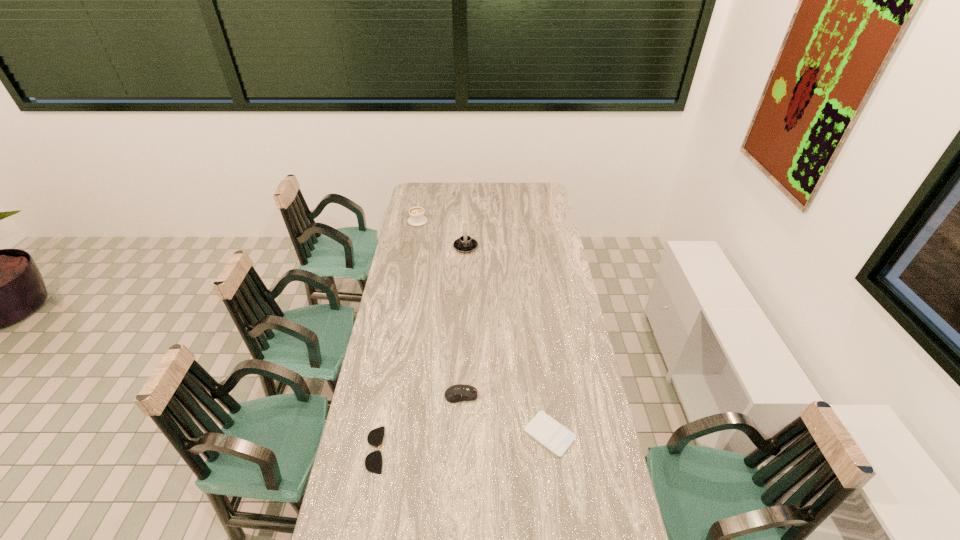
This screenshot has height=540, width=960. I want to click on vacant space located with a handle on the side of the tallest object, so click(x=467, y=214).

The image size is (960, 540). In order to click on vacant space located 0.120m to the right of the farthest object's handle in this screenshot , I will do `click(420, 204)`.

Locate an element on the screen. This screenshot has width=960, height=540. blank area located to the right of the farthest object's handle is located at coordinates (423, 188).

You are a GUI agent. You are given a task and a screenshot of the screen. Output one action in this format:
    pyautogui.click(x=<x>, y=<y>)
    Task: Click on the vacant point located 0.360m to the right of the farthest object's handle
    This screenshot has height=540, width=960.
    Given the screenshot: What is the action you would take?
    pyautogui.click(x=424, y=183)

Locate an element on the screen. free space located 0.080m on the button of the third nearest object is located at coordinates (500, 395).

Find the location of a particular element. The image size is (960, 540). free space located 0.230m on the left of the rightmost object is located at coordinates (455, 434).

This screenshot has height=540, width=960. In order to click on free space located on the right of the spectacles in this screenshot , I will do `click(454, 450)`.

At what (x,y) coordinates should I click in order to perform the action: click on cappuccino located in the left edge section of the desktop. Please return your answer as a coordinate pair (x, y). The width and height of the screenshot is (960, 540). Looking at the image, I should click on (417, 218).

In order to click on spectacles at the left edge in this screenshot , I will do `click(373, 462)`.

Locate an element on the screen. The image size is (960, 540). object situated at the right edge is located at coordinates (555, 437).